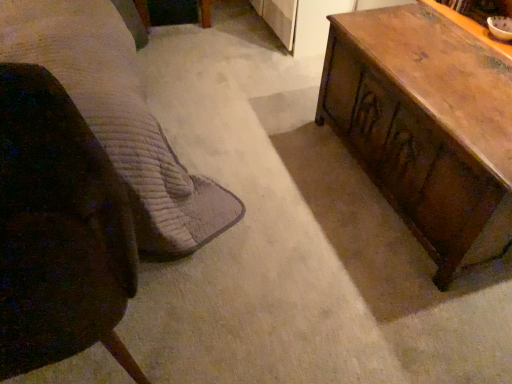
Question: From the image's perspective, is brown quilted fabric bed at left on wooden trunk at right?

Choices:
 (A) no
 (B) yes

Answer: (B)

Question: Is brown quilted fabric bed at left positioned in front of wooden trunk at right?

Choices:
 (A) no
 (B) yes

Answer: (B)

Question: Is brown quilted fabric bed at left oriented towards wooden trunk at right?

Choices:
 (A) yes
 (B) no

Answer: (B)

Question: Are brown quilted fabric bed at left and wooden trunk at right located far from each other?

Choices:
 (A) no
 (B) yes

Answer: (A)

Question: Can you see brown quilted fabric bed at left touching wooden trunk at right?

Choices:
 (A) yes
 (B) no

Answer: (B)

Question: In terms of width, does brown quilted fabric bed at left look wider or thinner when compared to wooden trunk at right?

Choices:
 (A) thin
 (B) wide

Answer: (B)

Question: Based on their positions, is brown quilted fabric bed at left located to the left or right of wooden trunk at right?

Choices:
 (A) left
 (B) right

Answer: (A)

Question: From a real-world perspective, is brown quilted fabric bed at left physically located above or below wooden trunk at right?

Choices:
 (A) below
 (B) above

Answer: (B)

Question: Is point (110, 92) positioned closer to the camera than point (373, 170)?

Choices:
 (A) farther
 (B) closer

Answer: (B)

Question: Considering the positions of wooden trunk at right and brown quilted fabric bed at left in the image, is wooden trunk at right taller or shorter than brown quilted fabric bed at left?

Choices:
 (A) short
 (B) tall

Answer: (A)

Question: Would you say wooden trunk at right is inside or outside brown quilted fabric bed at left?

Choices:
 (A) outside
 (B) inside

Answer: (A)

Question: From the image's perspective, is wooden trunk at right located above or below brown quilted fabric bed at left?

Choices:
 (A) above
 (B) below

Answer: (B)

Question: From a real-world perspective, is wooden trunk at right above or below brown quilted fabric bed at left?

Choices:
 (A) above
 (B) below

Answer: (B)

Question: Considering their positions, is dark brown leather chair at left located in front of or behind brown quilted fabric bed at left?

Choices:
 (A) front
 (B) behind

Answer: (A)

Question: Is dark brown leather chair at left inside the boundaries of brown quilted fabric bed at left, or outside?

Choices:
 (A) inside
 (B) outside

Answer: (A)